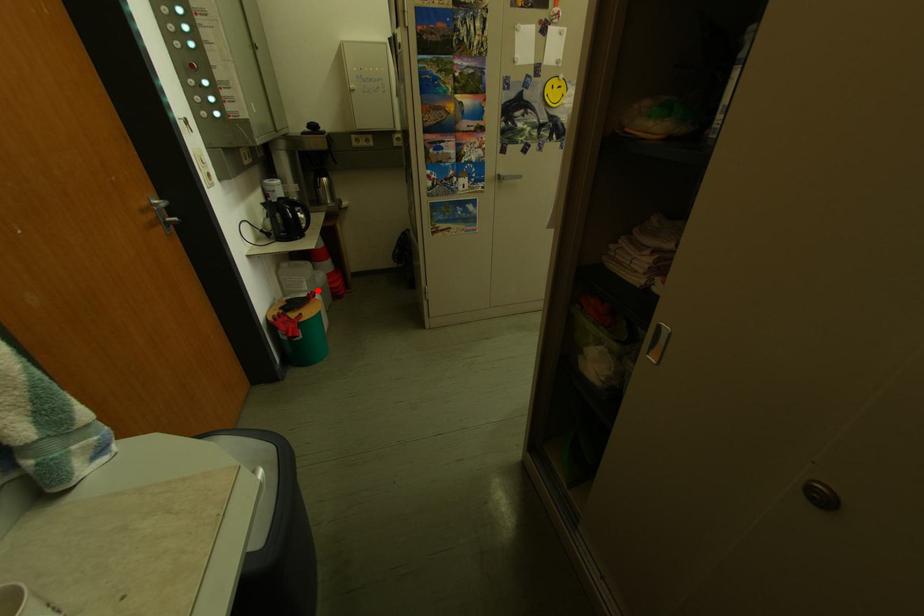
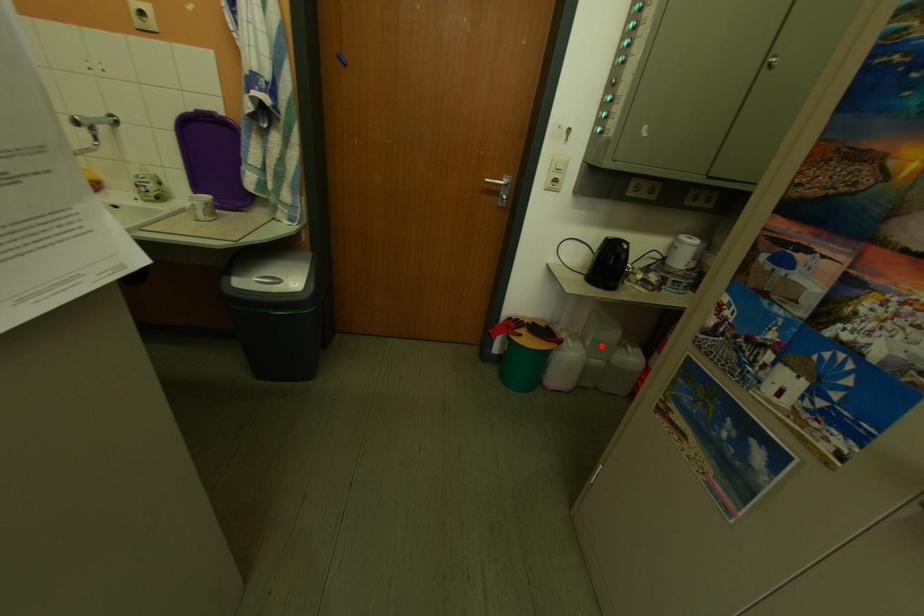
I am providing you with two images of the same scene from different viewpoints. A red point is marked on the first image and another point is marked on the second image. Does the point marked in image1 correspond to the same location as the one in image2?

Yes